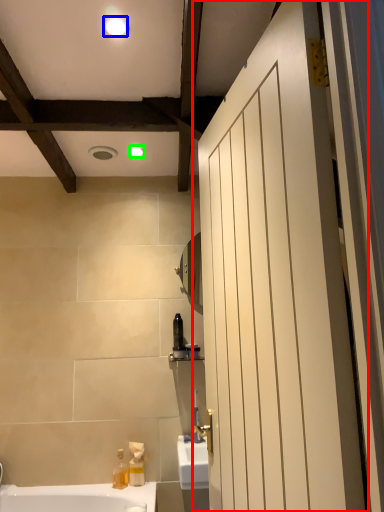
Question: Based on their relative distances, which object is nearer to door (highlighted by a red box)? Choose from light fixture (highlighted by a blue box) and light fixture (highlighted by a green box).

Choices:
 (A) light fixture
 (B) light fixture

Answer: (A)